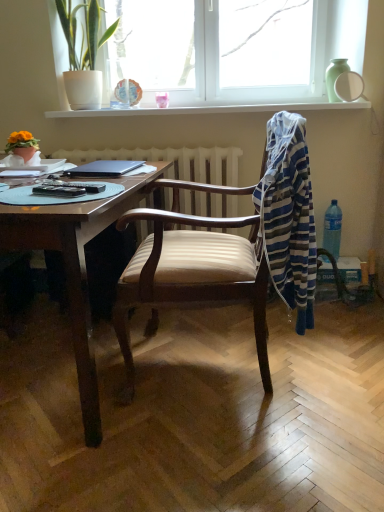
Identify the location of vacant space in front of black plastic remote control at table left. The image size is (384, 512). (53, 204).